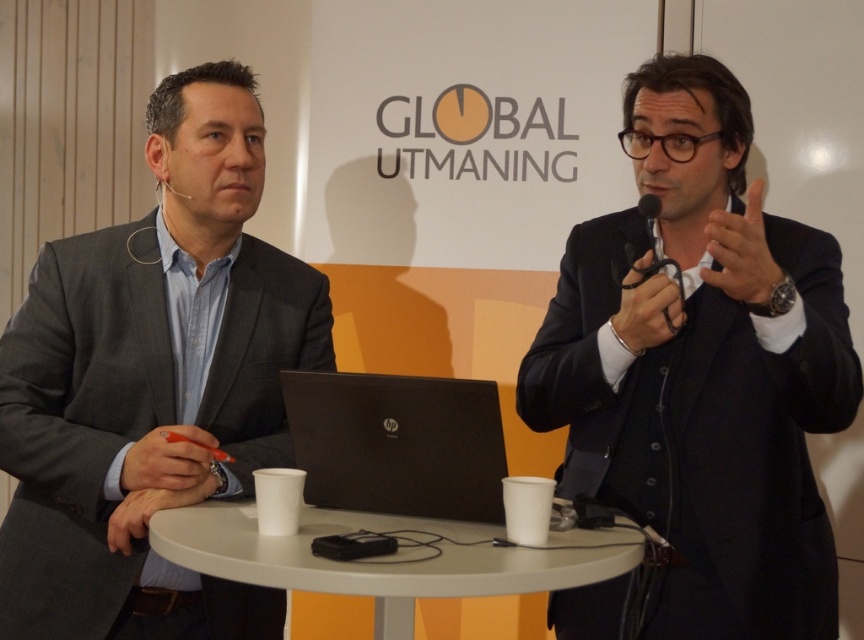
Question: Can you confirm if matte black hand at upper right is positioned above matte orange pen at lower left?

Choices:
 (A) no
 (B) yes

Answer: (B)

Question: Which of these objects is positioned closest to the matte orange pen at lower left?

Choices:
 (A) black matte suit at center
 (B) gray suit at left

Answer: (B)

Question: Estimate the real-world distances between objects in this image. Which object is farther from the matte orange pen at lower left?

Choices:
 (A) black matte suit at center
 (B) black leather microphone at center
 (C) white plastic table at center
 (D) matte black hand at upper right

Answer: (D)

Question: Which object is positioned farthest from the white plastic table at center?

Choices:
 (A) black leather microphone at center
 (B) gray suit at left

Answer: (A)

Question: Does black matte suit at center have a greater width compared to black leather microphone at center?

Choices:
 (A) yes
 (B) no

Answer: (A)

Question: Can you confirm if matte black hand at upper right is positioned to the left of matte orange pen at lower left?

Choices:
 (A) yes
 (B) no

Answer: (B)